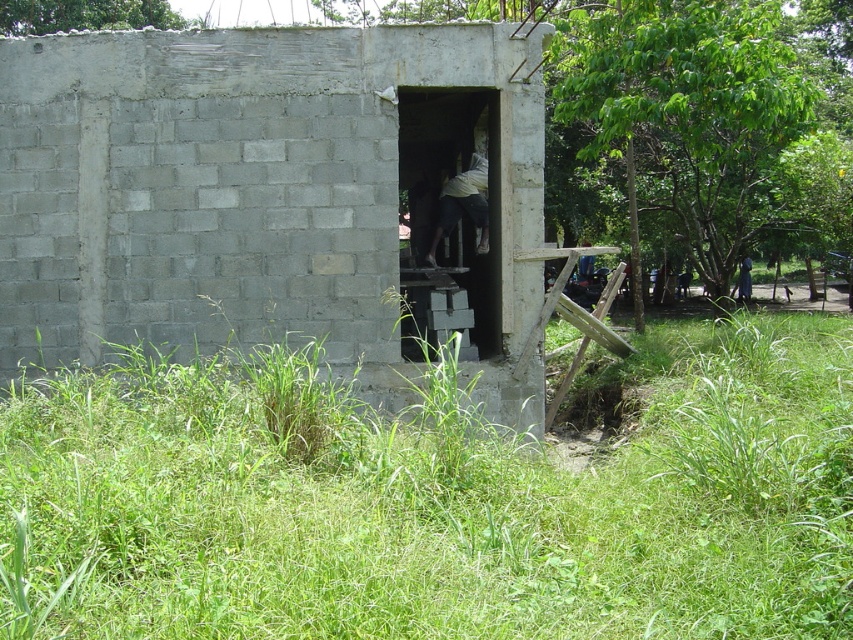
Question: Which object is farther from the camera taking this photo?

Choices:
 (A) green grass at lower center
 (B) dark blue fabric at center
 (C) gray concrete bunker at center

Answer: (B)

Question: Is green grass at lower center thinner than dark blue fabric at center?

Choices:
 (A) no
 (B) yes

Answer: (A)

Question: Does gray concrete bunker at center appear over dark blue fabric at center?

Choices:
 (A) yes
 (B) no

Answer: (A)

Question: Is the position of green grass at lower center more distant than that of dark blue fabric at center?

Choices:
 (A) yes
 (B) no

Answer: (B)

Question: Which point is farther to the camera?

Choices:
 (A) (525, 369)
 (B) (74, 426)
 (C) (474, 193)
 (D) (746, 260)

Answer: (D)

Question: Which point appears farthest from the camera in this image?

Choices:
 (A) (392, 61)
 (B) (750, 276)
 (C) (453, 186)
 (D) (380, 592)

Answer: (B)